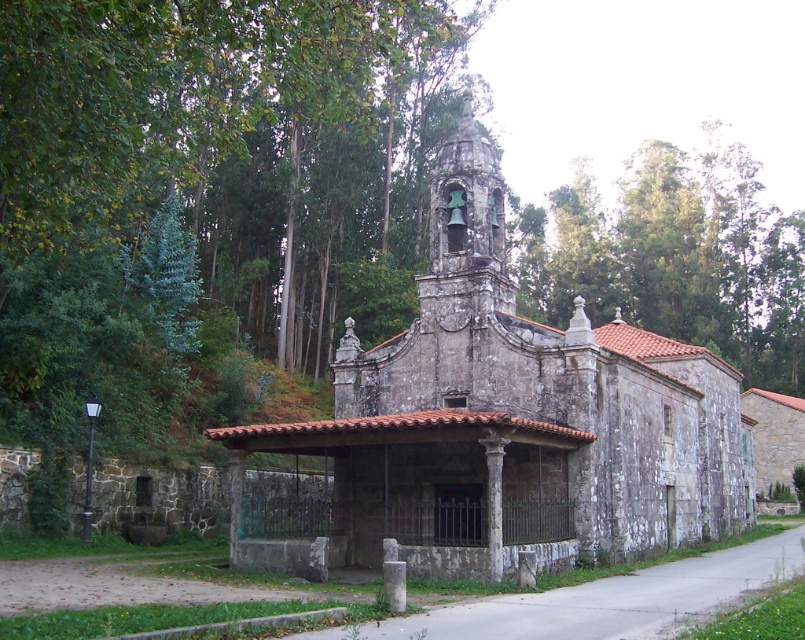
Which of these two, stone church at center or green leafy tree at upper center, stands taller?

green leafy tree at upper center is taller.

Consider the image. Is stone church at center to the left of green leafy tree at upper center from the viewer's perspective?

Correct, you'll find stone church at center to the left of green leafy tree at upper center.

What do you see at coordinates (506, 422) in the screenshot?
I see `stone church at center` at bounding box center [506, 422].

Where is `stone church at center`? The width and height of the screenshot is (805, 640). stone church at center is located at coordinates (506, 422).